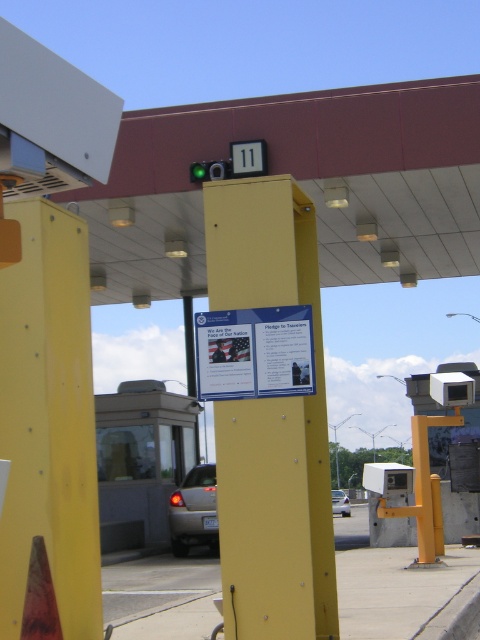
Which of these two, white paper sign at center or satin silver sedan at lower center, stands taller?

Standing taller between the two is satin silver sedan at lower center.

Is white paper sign at center above satin silver sedan at lower center?

Correct, white paper sign at center is located above satin silver sedan at lower center.

Locate an element on the screen. The width and height of the screenshot is (480, 640). white paper sign at center is located at coordinates (254, 353).

Is yellow matte signpost at center thinner than satin silver sedan at lower center?

Yes.

The height and width of the screenshot is (640, 480). What do you see at coordinates (271, 422) in the screenshot? I see `yellow matte signpost at center` at bounding box center [271, 422].

Does point (296, 250) lie behind point (177, 545)?

No, it is in front of (177, 545).

Image resolution: width=480 pixels, height=640 pixels. In order to click on yellow matte signpost at center in this screenshot , I will do `click(271, 422)`.

Measure the distance between white paper sign at center and camera.

white paper sign at center and camera are 4.40 meters apart from each other.

Can you confirm if white paper sign at center is wider than silver metallic car at center?

In fact, white paper sign at center might be narrower than silver metallic car at center.

Where is `white paper sign at center`? This screenshot has height=640, width=480. white paper sign at center is located at coordinates (254, 353).

Where is `white paper sign at center`? The image size is (480, 640). white paper sign at center is located at coordinates (254, 353).